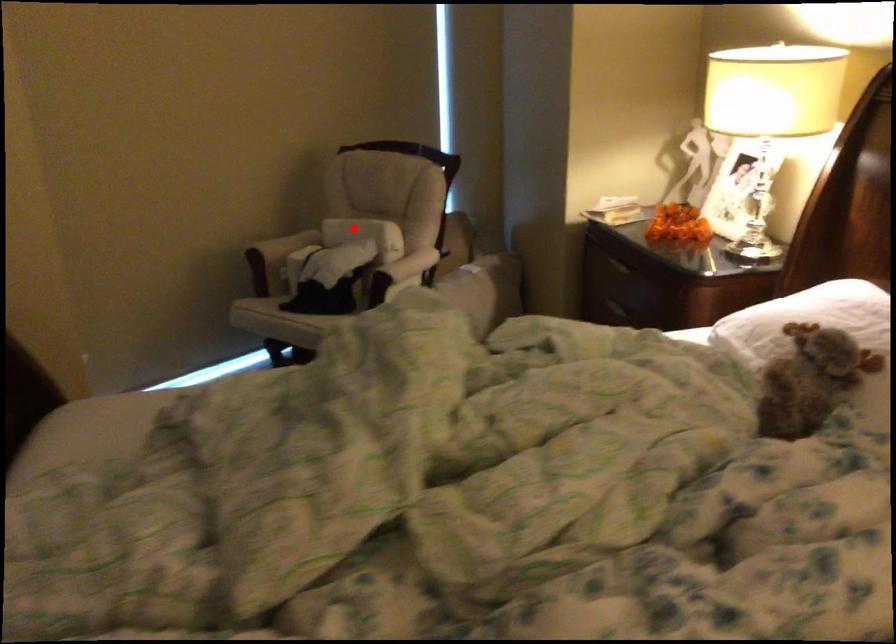
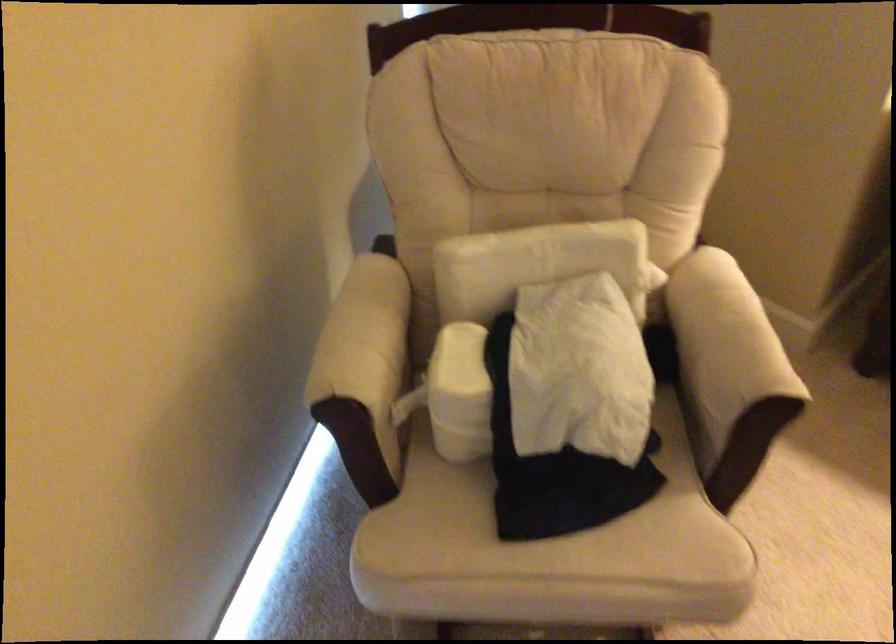
The point at the highlighted location is marked in the first image. Where is the corresponding point in the second image?

(533, 263)